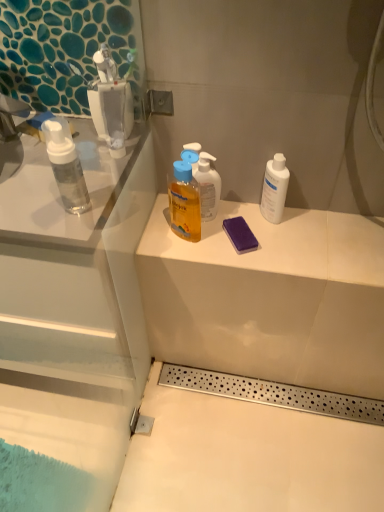
Question: Would you say purple sponge at center is outside matte white counter at center?

Choices:
 (A) no
 (B) yes

Answer: (B)

Question: Can you confirm if purple sponge at center is shorter than matte white counter at center?

Choices:
 (A) no
 (B) yes

Answer: (A)

Question: Can you confirm if purple sponge at center is taller than matte white counter at center?

Choices:
 (A) no
 (B) yes

Answer: (B)

Question: From a real-world perspective, does purple sponge at center stand above matte white counter at center?

Choices:
 (A) yes
 (B) no

Answer: (A)

Question: Is purple sponge at center at the right side of matte white counter at center?

Choices:
 (A) yes
 (B) no

Answer: (B)

Question: Based on their positions, is matte white counter at center located to the left or right of white matte bottle at right?

Choices:
 (A) right
 (B) left

Answer: (B)

Question: Looking at their shapes, would you say matte white counter at center is wider or thinner than white matte bottle at right?

Choices:
 (A) thin
 (B) wide

Answer: (B)

Question: Is point (354, 221) closer or farther from the camera than point (274, 155)?

Choices:
 (A) farther
 (B) closer

Answer: (A)

Question: In terms of size, does matte white counter at center appear bigger or smaller than white matte bottle at right?

Choices:
 (A) big
 (B) small

Answer: (A)

Question: Is point (196, 196) positioned closer to the camera than point (261, 197)?

Choices:
 (A) farther
 (B) closer

Answer: (B)

Question: Is translucent yellow liquid at upper center bigger or smaller than white matte bottle at right?

Choices:
 (A) big
 (B) small

Answer: (A)

Question: From a real-world perspective, relative to white matte bottle at right, is translucent yellow liquid at upper center vertically above or below?

Choices:
 (A) below
 (B) above

Answer: (B)

Question: Visually, is translucent yellow liquid at upper center positioned to the left or to the right of white matte bottle at right?

Choices:
 (A) left
 (B) right

Answer: (A)

Question: Visually, is matte white counter at center positioned to the left or to the right of translucent yellow liquid at upper center?

Choices:
 (A) right
 (B) left

Answer: (A)

Question: From the image's perspective, relative to translucent yellow liquid at upper center, is matte white counter at center above or below?

Choices:
 (A) below
 (B) above

Answer: (A)